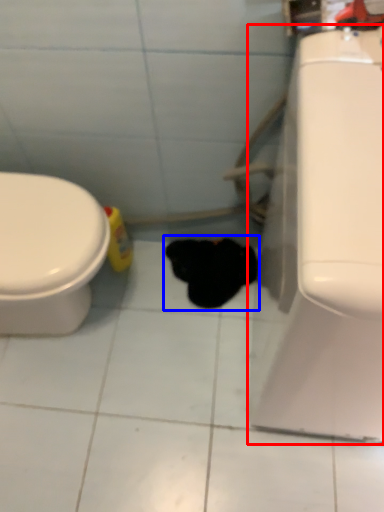
Question: Which object is closer to the camera taking this photo, porcelain (highlighted by a red box) or animal (highlighted by a blue box)?

Choices:
 (A) porcelain
 (B) animal

Answer: (A)